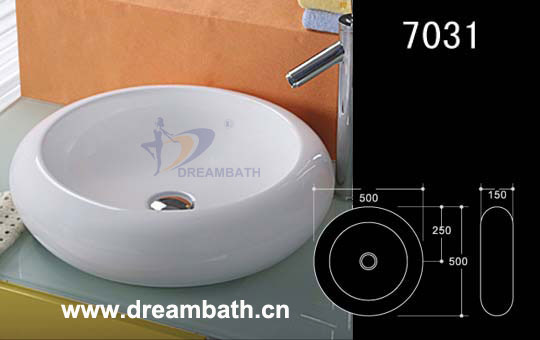
I want to click on faucet, so click(x=322, y=57).